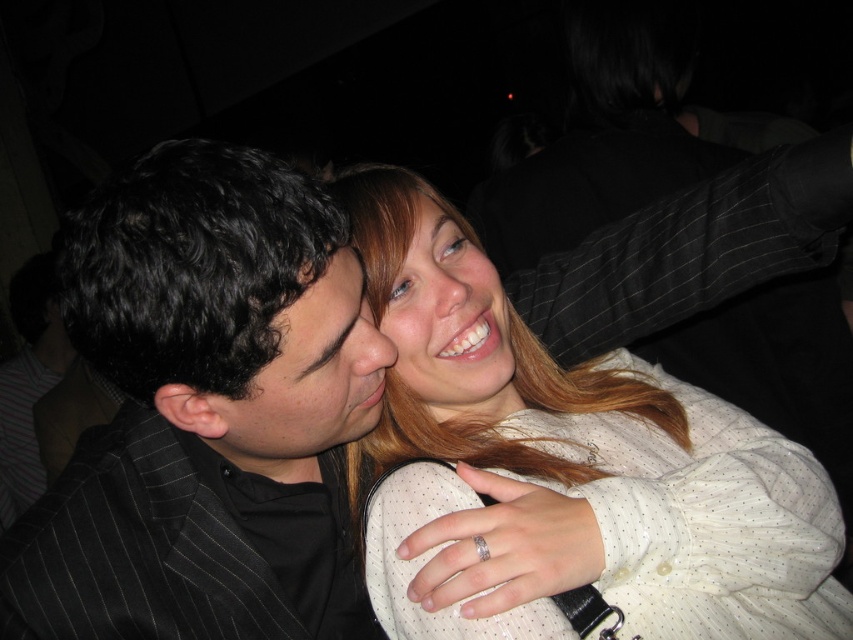
Is black pinstripe suit at left to the left of smooth cream blouse at center from the viewer's perspective?

Correct, you'll find black pinstripe suit at left to the left of smooth cream blouse at center.

Does point (310, 625) come farther from viewer compared to point (505, 400)?

No, (310, 625) is in front of (505, 400).

What do you see at coordinates (206, 412) in the screenshot? I see `black pinstripe suit at left` at bounding box center [206, 412].

Where is `black pinstripe suit at left`? black pinstripe suit at left is located at coordinates (206, 412).

Is black pinstripe suit at left positioned behind matte black face at center?

No.

Locate an element on the screen. The height and width of the screenshot is (640, 853). black pinstripe suit at left is located at coordinates (206, 412).

Does point (378, 372) lie in front of point (508, 333)?

That is True.

Who is lower down, matte black face at center or smooth cream blouse at center?

matte black face at center is lower down.

Is point (351, 353) behind point (456, 372)?

That is False.

Identify the location of matte black face at center. (309, 376).